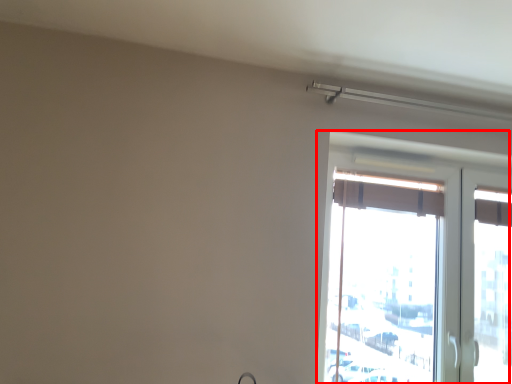
Question: From the image's perspective, what is the correct spatial relationship of window (annotated by the red box) in relation to curtain?

Choices:
 (A) above
 (B) below

Answer: (B)